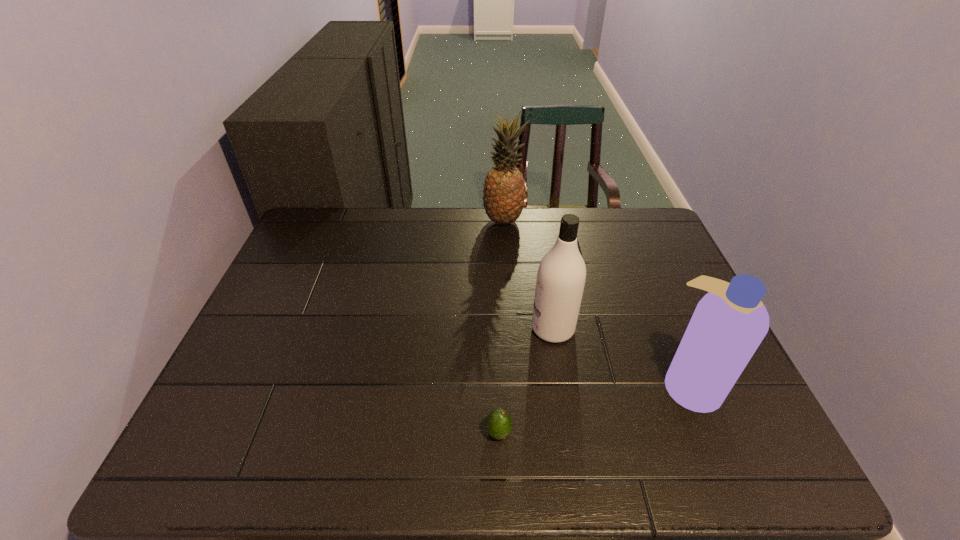
Find the location of `free space between the avocado and the pineapple`. free space between the avocado and the pineapple is located at coordinates (501, 327).

Locate an element on the screen. Image resolution: width=960 pixels, height=540 pixels. object that is the second closest to the right shampoo is located at coordinates (498, 425).

Where is `the second closest object to the left shampoo`? the second closest object to the left shampoo is located at coordinates (498, 425).

Where is `vacant region that satisfies the following two spatial constraints: 1. on the front-facing side of the farther shampoo; 2. on the left side of the nearer shampoo`? Image resolution: width=960 pixels, height=540 pixels. vacant region that satisfies the following two spatial constraints: 1. on the front-facing side of the farther shampoo; 2. on the left side of the nearer shampoo is located at coordinates (562, 384).

Where is `free space that satisfies the following two spatial constraints: 1. on the back side of the shortest object; 2. on the right side of the second nearest object`? The image size is (960, 540). free space that satisfies the following two spatial constraints: 1. on the back side of the shortest object; 2. on the right side of the second nearest object is located at coordinates (497, 384).

Find the location of `free spot that satisfies the following two spatial constraints: 1. on the back side of the rightmost object; 2. on the front-facing side of the farther shampoo`. free spot that satisfies the following two spatial constraints: 1. on the back side of the rightmost object; 2. on the front-facing side of the farther shampoo is located at coordinates (666, 329).

Where is `vacant space that satisfies the following two spatial constraints: 1. on the front-facing side of the second farthest object; 2. on the right side of the second nearest object`? This screenshot has width=960, height=540. vacant space that satisfies the following two spatial constraints: 1. on the front-facing side of the second farthest object; 2. on the right side of the second nearest object is located at coordinates (562, 384).